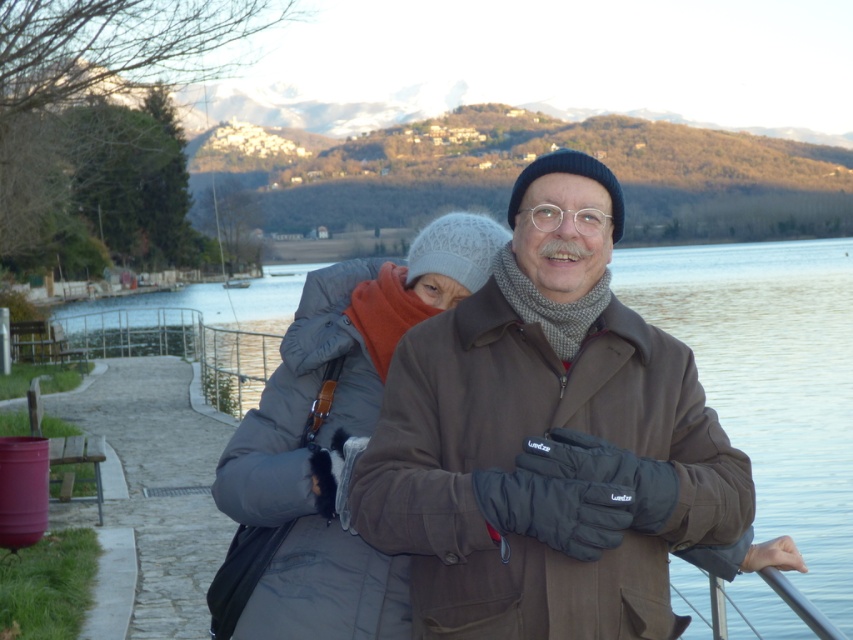
You are standing at the entrance of the pathway and want to know the position of the gray down jacket at center relative to the paved pathway. Is it closer to the water or the mountains?

The gray down jacket at center is located at point 0.692 on the x axis and 0.386 on the y axis, which places it closer to the water than the mountains.

Looking at this image, you are standing on the paved pathway and want to take a photo of the clear water at center. Where should you aim your camera to capture it?

You should aim your camera at point [770,380] to capture the clear water at center.